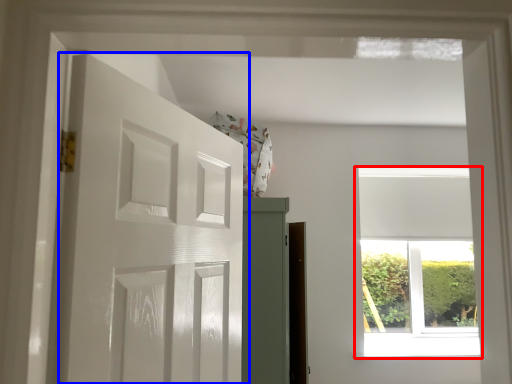
Question: Which object appears farthest to the camera in this image, window (highlighted by a red box) or door (highlighted by a blue box)?

Choices:
 (A) window
 (B) door

Answer: (A)